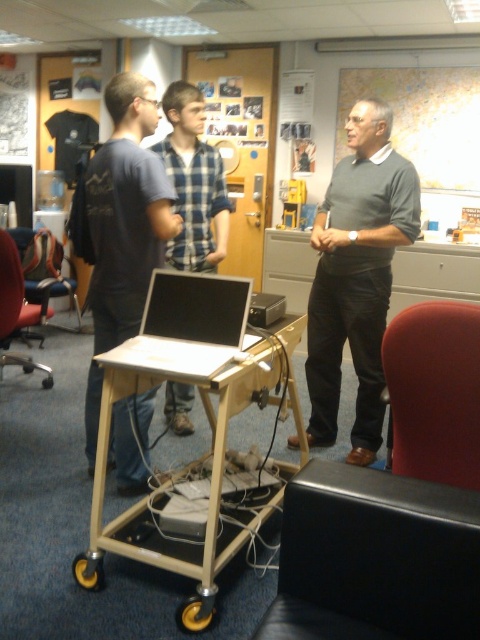
In the scene shown: Does matte blue shirt at center appear under red leather swivel chair at lower right?

No.

Between matte blue shirt at center and red leather swivel chair at lower right, which one has less height?

With less height is red leather swivel chair at lower right.

Between point (118, 282) and point (451, 458), which one is positioned in front?

Point (451, 458) is in front.

The width and height of the screenshot is (480, 640). I want to click on matte blue shirt at center, so click(x=127, y=211).

Who is taller, matte blue shirt at center or blue plaid shirt at center?

matte blue shirt at center

Between matte blue shirt at center and blue plaid shirt at center, which one appears on the right side from the viewer's perspective?

Positioned to the right is blue plaid shirt at center.

This screenshot has width=480, height=640. Describe the element at coordinates (127, 211) in the screenshot. I see `matte blue shirt at center` at that location.

In order to click on matte blue shirt at center in this screenshot , I will do `click(127, 211)`.

Is the position of gray sweater at center less distant than that of blue plaid shirt at center?

Yes, gray sweater at center is closer to the viewer.

Which is above, gray sweater at center or blue plaid shirt at center?

blue plaid shirt at center is higher up.

Does point (363, 292) lie behind point (190, 124)?

No, (363, 292) is in front of (190, 124).

At what (x,y) coordinates should I click in order to perform the action: click on gray sweater at center. Please return your answer as a coordinate pair (x, y). Looking at the image, I should click on (357, 276).